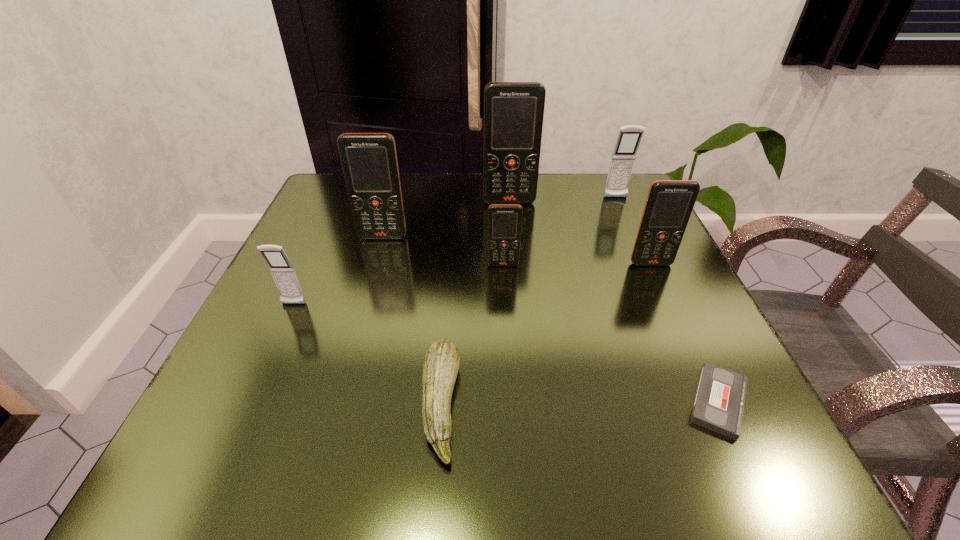
Find the location of a particular element. The image size is (960, 540). the farthest orange cellular telephone is located at coordinates (513, 111).

Find the location of a particular element. The height and width of the screenshot is (540, 960). the tallest cellular telephone is located at coordinates (513, 111).

Locate an element on the screen. The height and width of the screenshot is (540, 960). the third farthest object is located at coordinates (369, 160).

Where is `the third smallest orange cellular telephone`? Image resolution: width=960 pixels, height=540 pixels. the third smallest orange cellular telephone is located at coordinates (369, 160).

Image resolution: width=960 pixels, height=540 pixels. What are the coordinates of `the farther gray cellular telephone` in the screenshot? It's located at (624, 154).

Find the location of a particular element. The image size is (960, 540). the bigger gray cellular telephone is located at coordinates click(624, 154).

I want to click on the third biggest orange cellular telephone, so click(669, 204).

Where is `the smallest orange cellular telephone`? The height and width of the screenshot is (540, 960). the smallest orange cellular telephone is located at coordinates (504, 220).

At what (x,y) coordinates should I click in order to perform the action: click on the leftmost object. Please return your answer as a coordinate pair (x, y). The image size is (960, 540). Looking at the image, I should click on (285, 277).

You are a GUI agent. You are given a task and a screenshot of the screen. Output one action in this format:
    pyautogui.click(x=<x>, y=<y>)
    Task: Click on the left gray cellular telephone
    
    Given the screenshot: What is the action you would take?
    pyautogui.click(x=285, y=277)